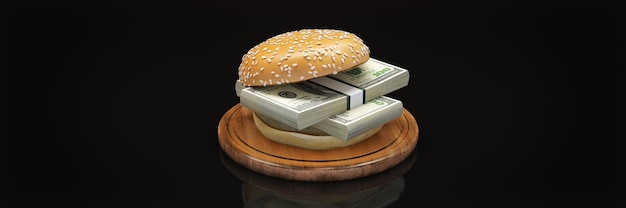
Identify the location of reflection of wooden base. (397, 175).